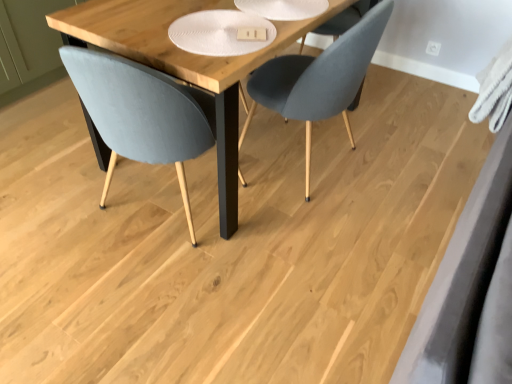
Find the location of `free space on the front side of matte gray chair at left, which is counted as the first chair, starting from the left`. free space on the front side of matte gray chair at left, which is counted as the first chair, starting from the left is located at coordinates [x=144, y=294].